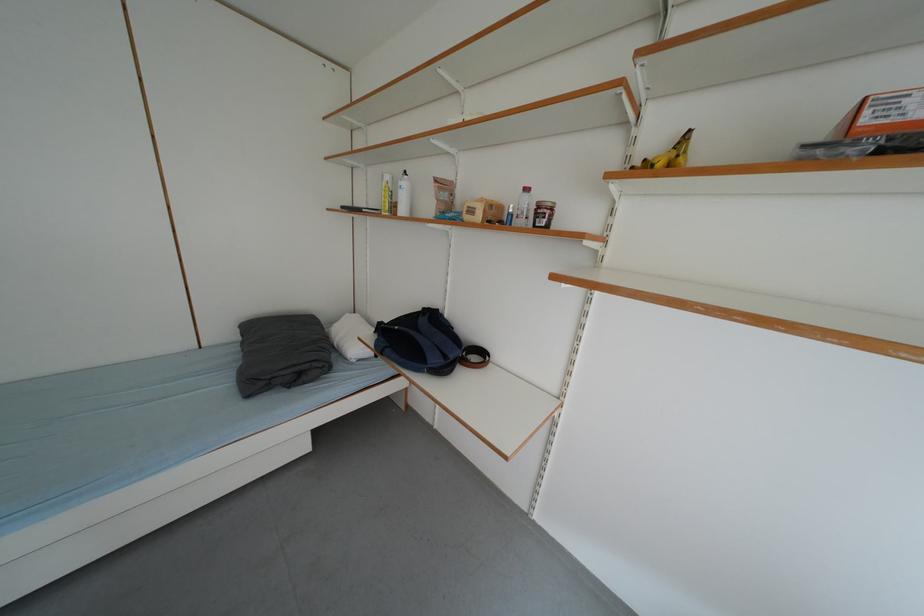
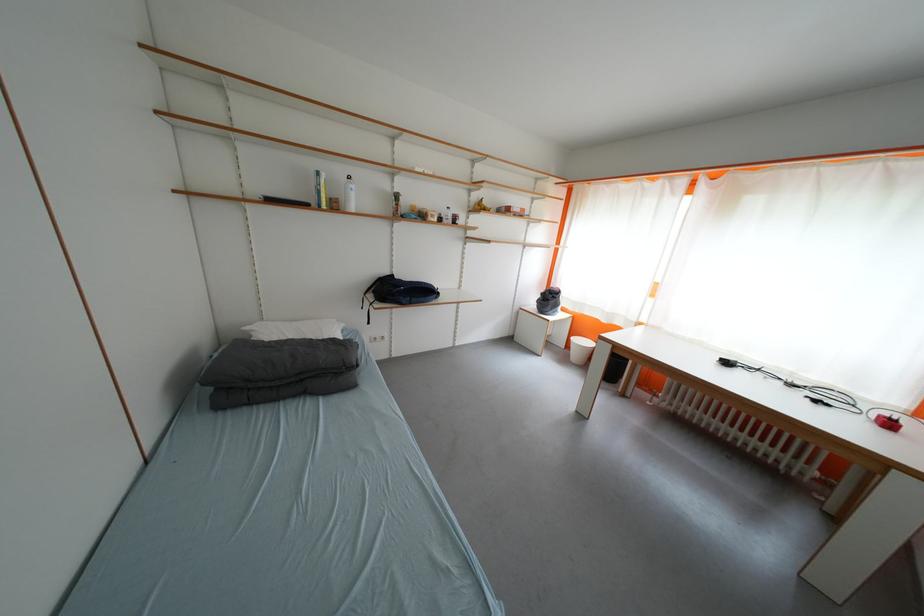
Locate, in the second image, the point that corresponds to pixel 617 231 in the first image.

(476, 225)